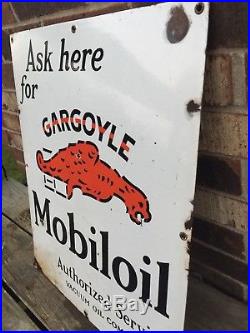
You are a GUI agent. You are given a task and a screenshot of the screen. Output one action in this format:
    pyautogui.click(x=<x>, y=<y>)
    Task: Click on the brick wall in background
    The image size is (250, 333).
    Given the screenshot: What is the action you would take?
    pyautogui.click(x=223, y=207), pyautogui.click(x=221, y=48), pyautogui.click(x=33, y=6), pyautogui.click(x=5, y=129)